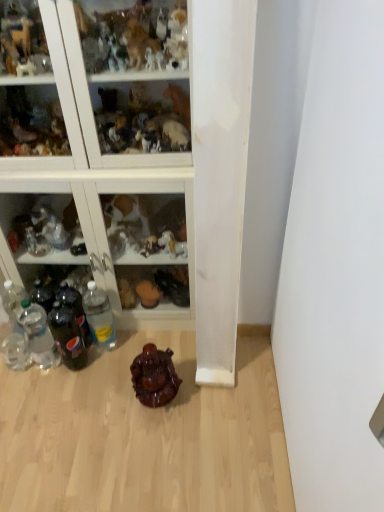
I want to click on free space in front of shiny brown statue at center, so coord(163,441).